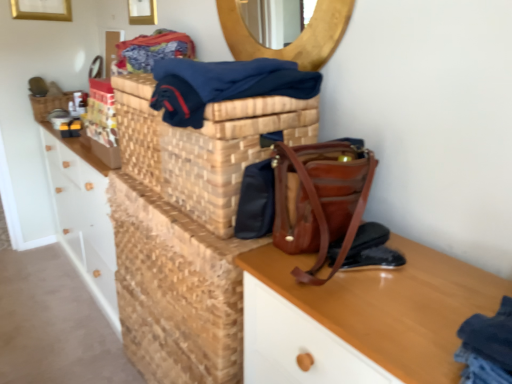
This screenshot has width=512, height=384. I want to click on vacant space in front of leather at center, the 1th shoe in the top-to-bottom sequence, so click(377, 299).